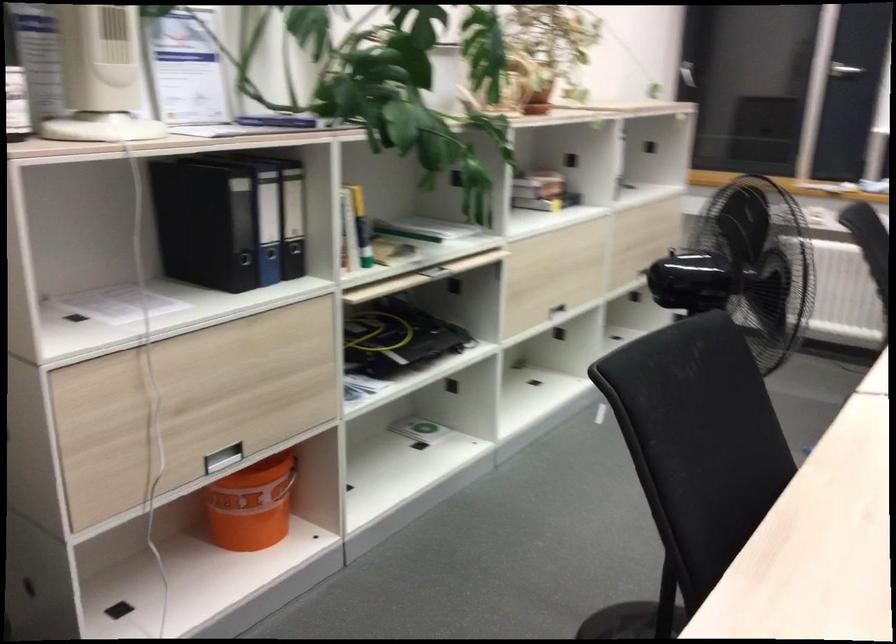
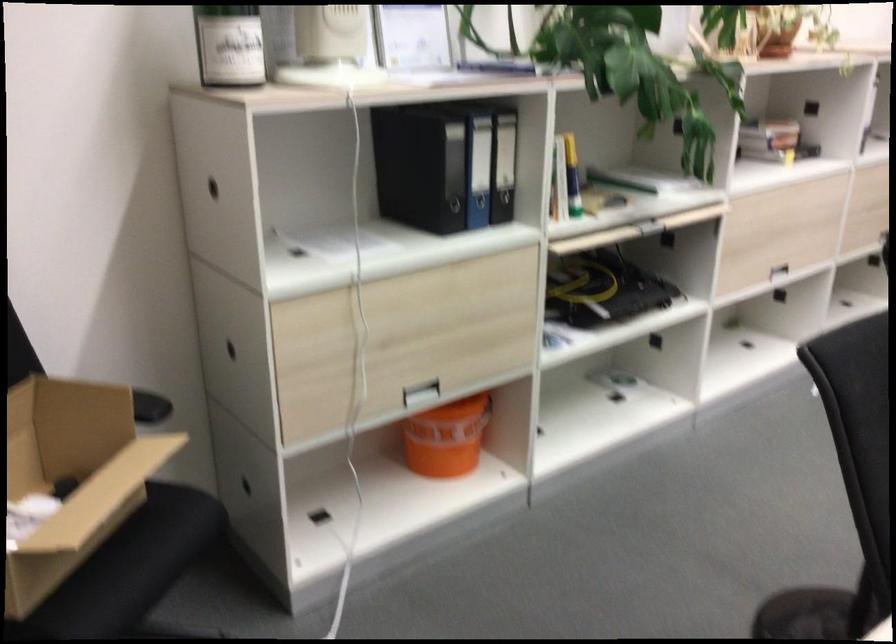
Locate, in the second image, the point that corresponds to (x=295, y=218) in the first image.

(504, 165)